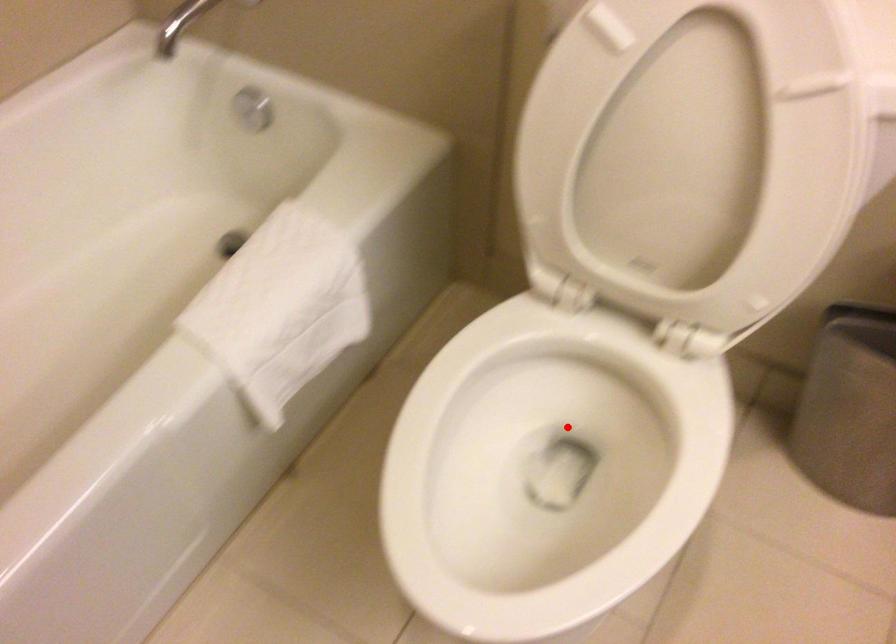
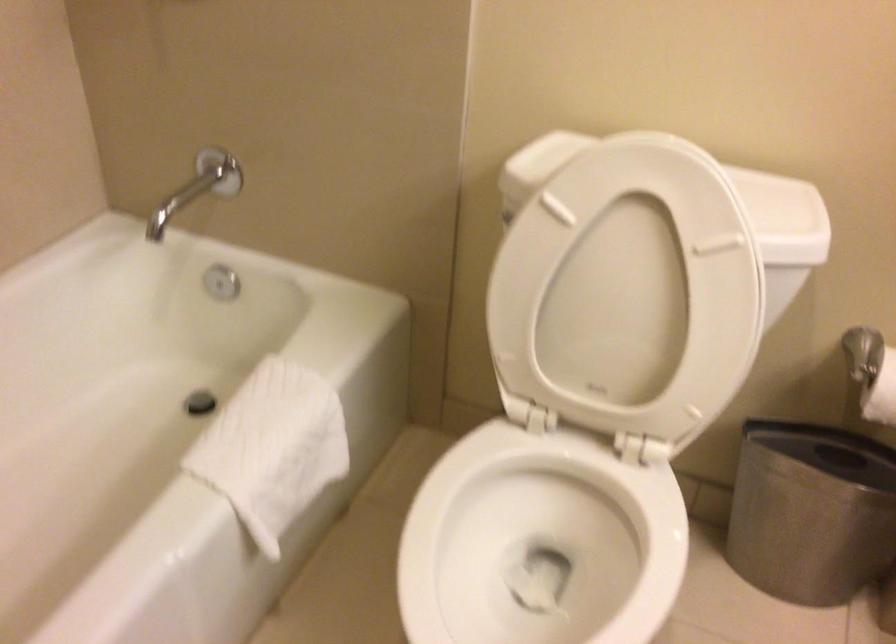
Question: A red point is marked in image1. In image2, is the corresponding 3D point closer to the camera or farther? Reply with the corresponding letter.

Choices:
 (A) The corresponding 3D point is closer.
 (B) The corresponding 3D point is farther.

Answer: (B)